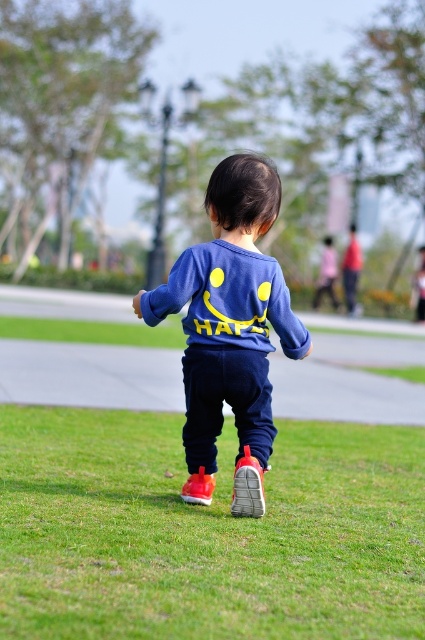
Question: Is green grass at lower center to the left of blue matte sweatshirt at center from the viewer's perspective?

Choices:
 (A) yes
 (B) no

Answer: (B)

Question: Is green grass at lower center further to the viewer compared to blue matte sweatshirt at center?

Choices:
 (A) no
 (B) yes

Answer: (A)

Question: Does green grass at lower center appear on the right side of blue matte sweatshirt at center?

Choices:
 (A) yes
 (B) no

Answer: (A)